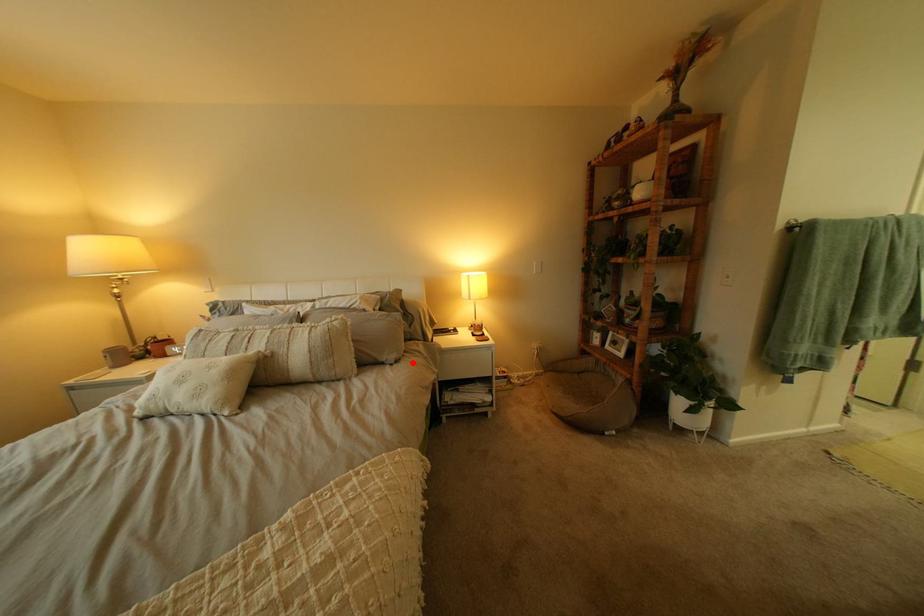
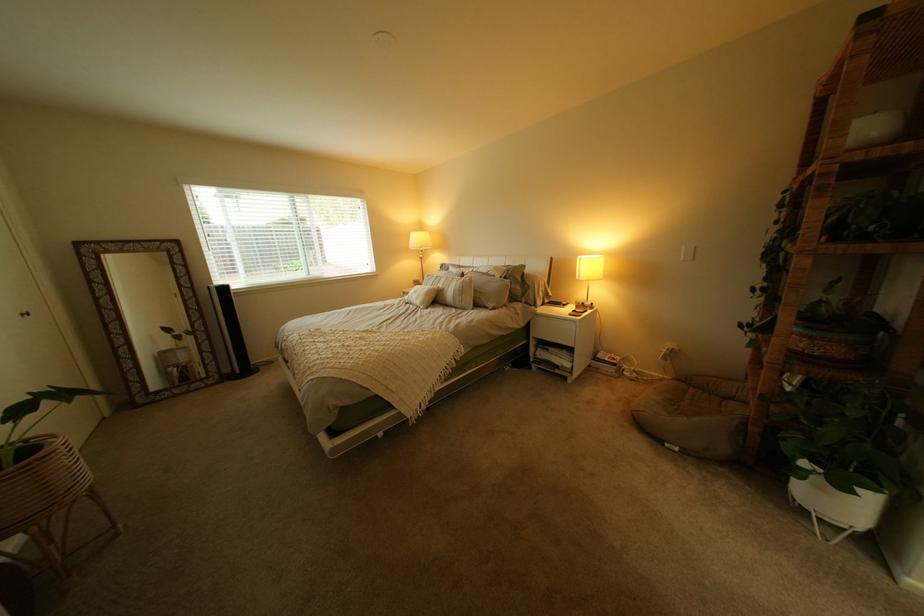
Locate, in the second image, the point that corresponds to the highlighted location in the first image.

(509, 310)